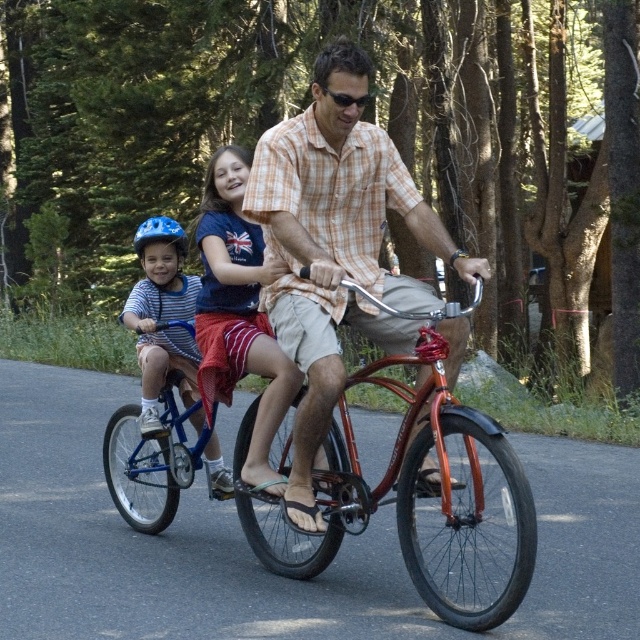
Question: Is matte orange shirt at center further to the viewer compared to matte blue helmet at left?

Choices:
 (A) yes
 (B) no

Answer: (B)

Question: Does matte orange shirt at center have a smaller size compared to matte blue helmet at left?

Choices:
 (A) yes
 (B) no

Answer: (B)

Question: Estimate the real-world distances between objects in this image. Which object is farther from the matte orange shirt at center?

Choices:
 (A) blue helmet at left
 (B) matte blue helmet at left
 (C) shiny metallic bicycle at center

Answer: (B)

Question: Which point is closer to the camera?

Choices:
 (A) (298, 260)
 (B) (163, 266)
 (C) (440, 368)

Answer: (C)

Question: Estimate the real-world distances between objects in this image. Which object is farther from the matte orange shirt at center?

Choices:
 (A) shiny metallic bicycle at center
 (B) matte blue helmet at left
 (C) blue helmet at left

Answer: (B)

Question: Is matte orange shirt at center bigger than shiny metallic bicycle at center?

Choices:
 (A) yes
 (B) no

Answer: (B)